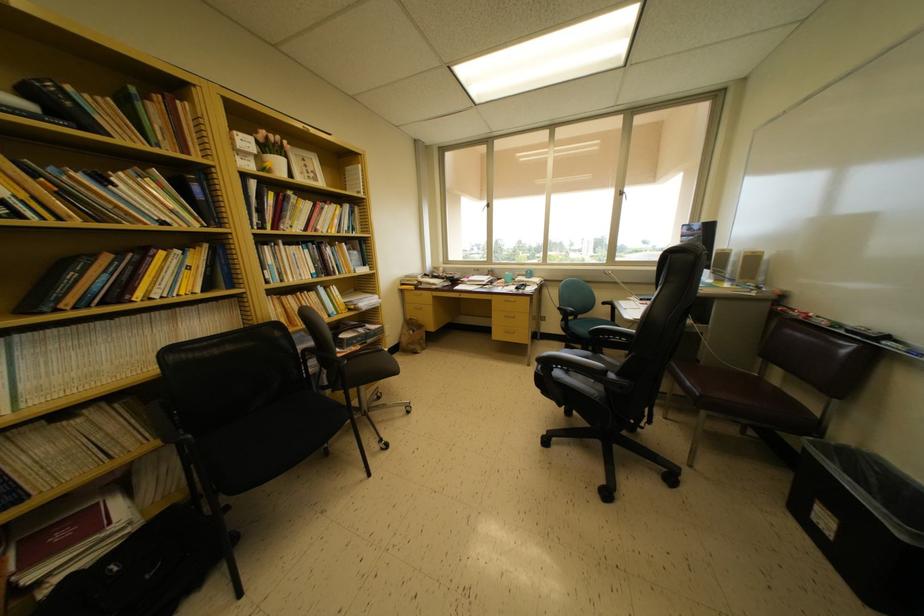
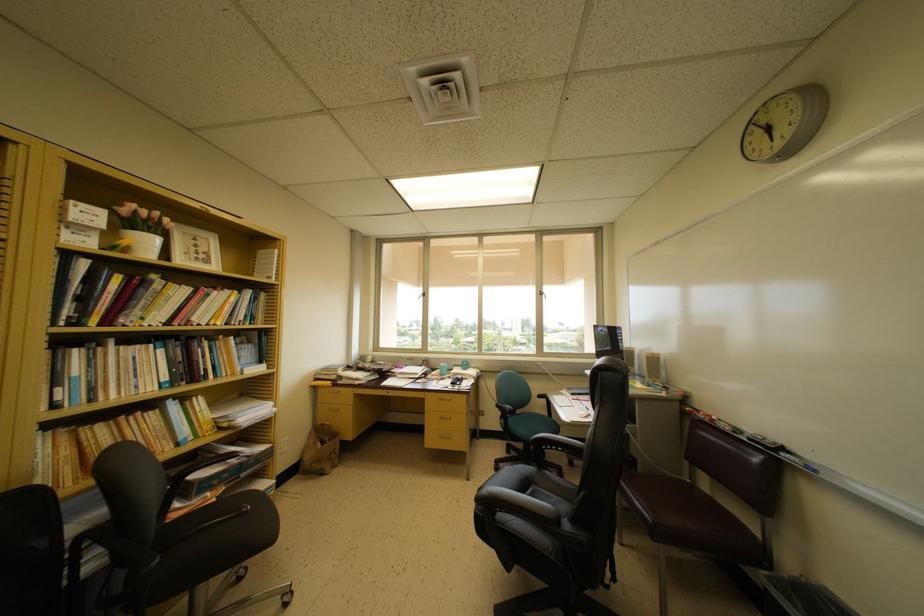
In the second image, find the point that corresponds to (614,325) in the first image.

(551, 419)